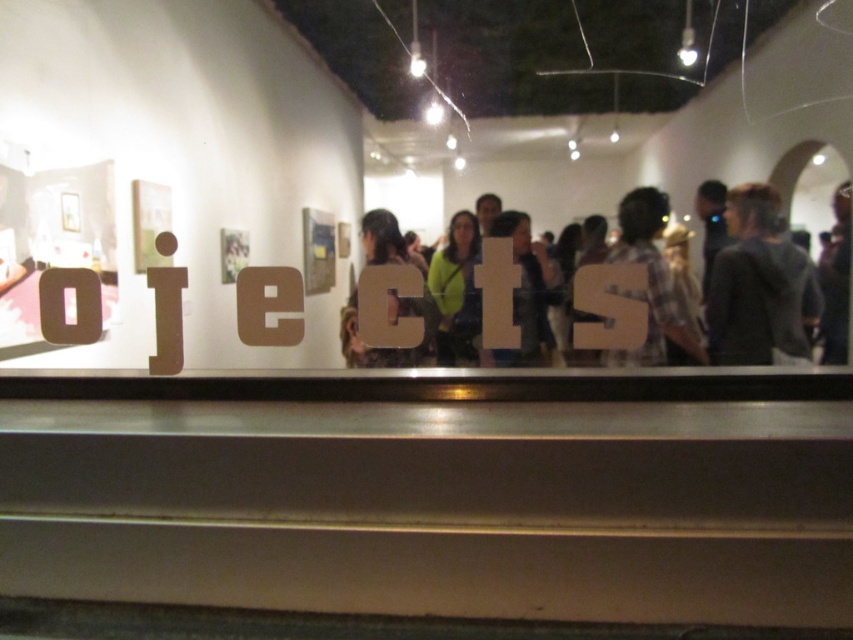
You are an artist trying to place a small sculpture on the reflective surface in the foreground. The sculpture is exactly the same size as the dark gray sweater at right. Will it fit entirely within the matte brown letter c at center?

The dark gray sweater at right is smaller than the matte brown letter c at center, so the sculpture will fit entirely within the matte brown letter c at center.

You are standing in the art gallery and see two points marked on the reflective surface in front of you. Which point, point (761, 342) or point (369, 262), is closer to you?

Point (761, 342) is closer to the viewer than point (369, 262).

You are an art curator standing at the entrance of the gallery. You need to place a new sculpture exactly at the center of the reflective surface in the foreground. Given that the reflective surface is a rectangle with coordinates from point A at the bottom left corner at position 0.1,0.1 to point B at the top right corner at position 0.9,0.9, can you determine if the dark gray sweater at right will be in the way of the sculpture placement?

The dark gray sweater at right is located at position (x=758, y=284). The center of the reflective surface would be at position (x=426, y=320). Since the sweater is at (x=758, y=284), it is not at the center coordinates, so it won not obstruct the placement of the sculpture at the center.